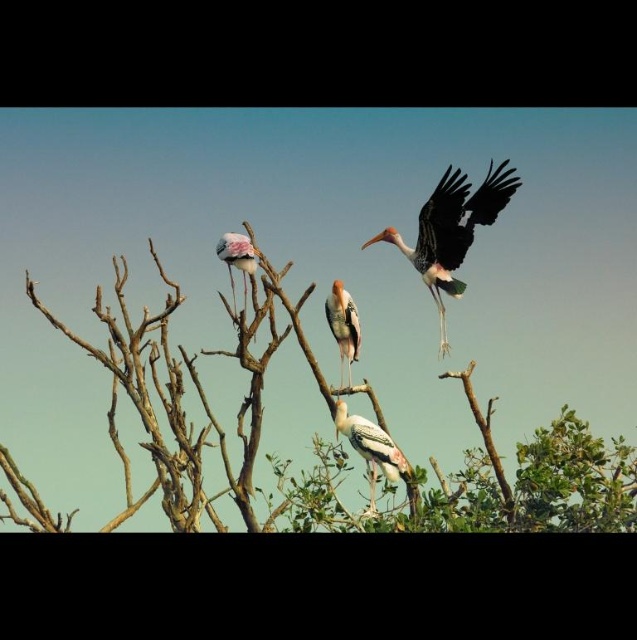
You are a birdwatcher observing the scene. You notice the green leafy tree at upper center and the speckled feathered bird at center. Which object is positioned to the left of the other?

The green leafy tree at upper center is to the left of the speckled feathered bird at center.

You are standing in the middle of the field looking at the tree with storks. There is a painted wood stork at center marked by point (343, 324). If you want to throw a small stone to hit the painted wood stork at center, in which direction should you aim relative to your current position?

The painted wood stork at center is located at point (343, 324), which is the center of the image. Therefore, you should aim directly at the center of the image to hit the painted wood stork at center.

You are a birdwatcher observing the painted wood stork at center and the white feathered bird at upper center. Which of these birds is taller?

The painted wood stork at center is much taller than the white feathered bird at upper center.